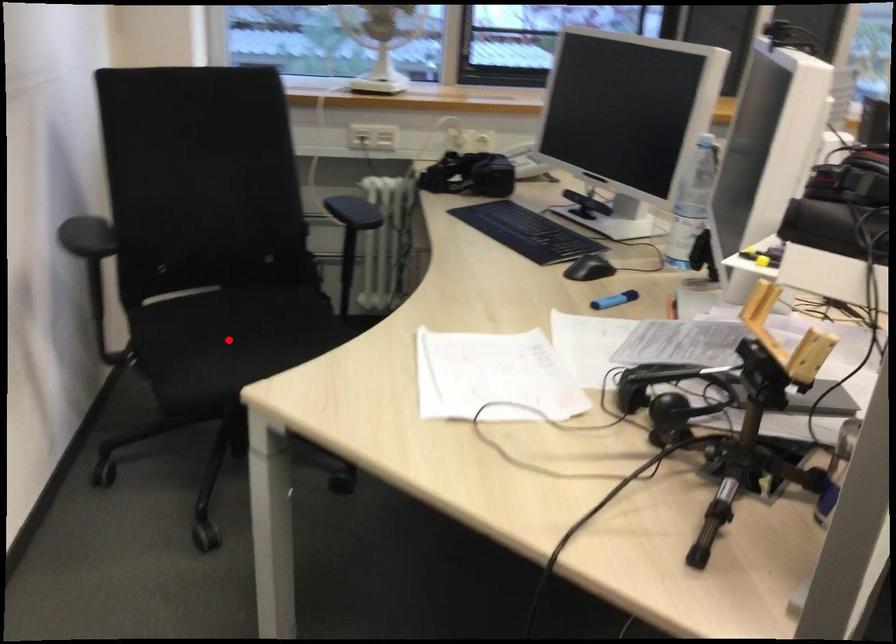
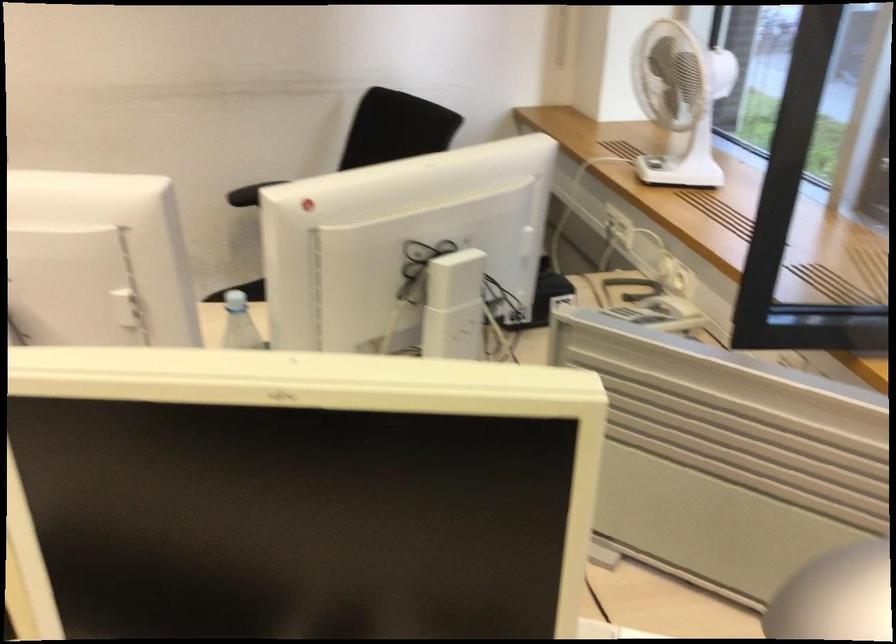
Question: I am providing you with two images of the same scene from different viewpoints. A red point is marked on the first image. At the location where the point appears in image 1, is it still visible in image 2?

Choices:
 (A) Yes
 (B) No

Answer: (B)